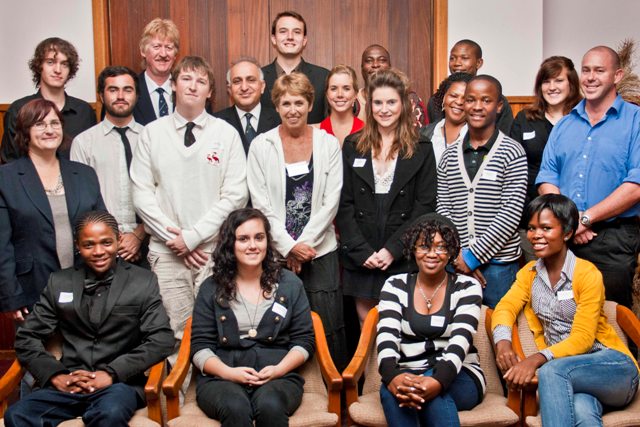
Locate an element on the screen. The width and height of the screenshot is (640, 427). wood panels is located at coordinates (376, 26), (204, 35).